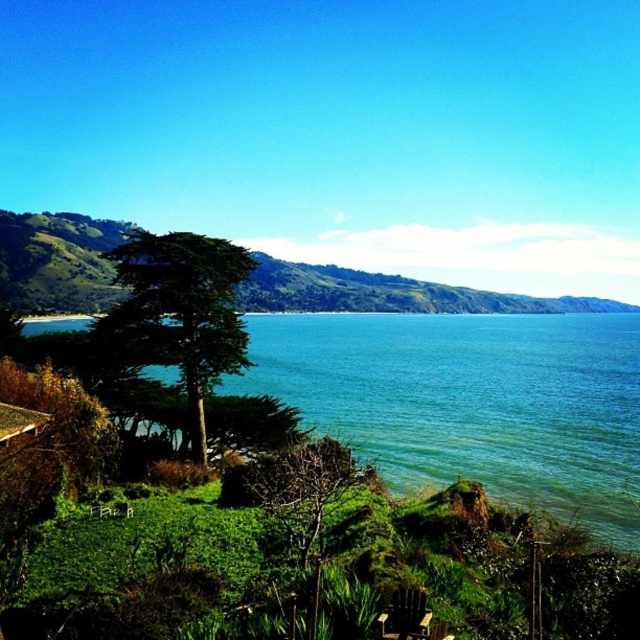
Between blue water at center and green leafy tree at center-left, which one is positioned lower?

green leafy tree at center-left

Can you confirm if blue water at center is positioned to the right of green leafy tree at center-left?

Yes, blue water at center is to the right of green leafy tree at center-left.

Who is more distant from viewer, (557, 484) or (195, 397)?

The point (557, 484) is behind.

Image resolution: width=640 pixels, height=640 pixels. I want to click on blue water at center, so click(x=472, y=403).

Is green leafy tree at center-left further to camera compared to green leafy tree at lower center?

Yes, green leafy tree at center-left is behind green leafy tree at lower center.

Does green leafy tree at center-left have a lesser width compared to green leafy tree at lower center?

No, green leafy tree at center-left is not thinner than green leafy tree at lower center.

Locate an element on the screen. The image size is (640, 640). green leafy tree at center-left is located at coordinates (x=177, y=314).

Can you confirm if green grassy hillside at upper left is smaller than green leafy tree at lower center?

Actually, green grassy hillside at upper left might be larger than green leafy tree at lower center.

Measure the distance between green grassy hillside at upper left and camera.

The distance of green grassy hillside at upper left from camera is 183.39 meters.

Is point (10, 269) positioned after point (336, 460)?

Yes, it is behind point (336, 460).

This screenshot has width=640, height=640. Identify the location of green grassy hillside at upper left. (388, 292).